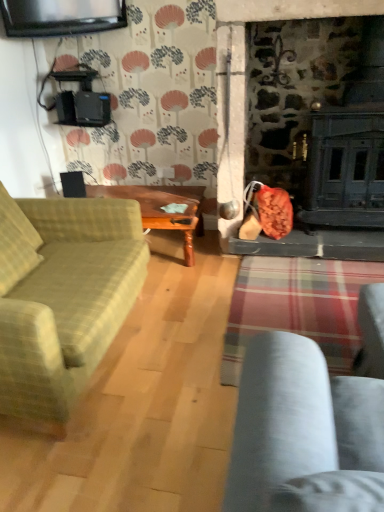
This screenshot has width=384, height=512. Find the location of `wooden polished table at center`. wooden polished table at center is located at coordinates (161, 208).

This screenshot has height=512, width=384. What do you see at coordinates (161, 208) in the screenshot?
I see `wooden polished table at center` at bounding box center [161, 208].

Looking at this image, what is the approximate width of wooden polished table at center?

wooden polished table at center is 24.17 inches in width.

You are a GUI agent. You are given a task and a screenshot of the screen. Output one action in this format:
    pyautogui.click(x=<x>, y=<y>)
    Task: Click on the green plaid fabric couch at left
    This screenshot has height=512, width=384.
    Given the screenshot: What is the action you would take?
    pyautogui.click(x=62, y=295)

Image resolution: width=384 pixels, height=512 pixels. What do you see at coordinates (62, 295) in the screenshot?
I see `green plaid fabric couch at left` at bounding box center [62, 295].

Image resolution: width=384 pixels, height=512 pixels. Identify the location of wooden polished table at center. (161, 208).

Is wooden polished table at center at the right side of green plaid fabric couch at left?

Correct, you'll find wooden polished table at center to the right of green plaid fabric couch at left.

Is the position of wooden polished table at center more distant than that of green plaid fabric couch at left?

Yes, wooden polished table at center is behind green plaid fabric couch at left.

Considering the positions of point (141, 191) and point (5, 318), is point (141, 191) closer or farther from the camera than point (5, 318)?

Point (141, 191).

From the image's perspective, which one is positioned lower, wooden polished table at center or green plaid fabric couch at left?

green plaid fabric couch at left, from the image's perspective.

From a real-world perspective, is wooden polished table at center positioned above or below green plaid fabric couch at left?

In terms of real-world spatial position, wooden polished table at center is below green plaid fabric couch at left.

Considering the sizes of objects wooden polished table at center and green plaid fabric couch at left in the image provided, who is wider, wooden polished table at center or green plaid fabric couch at left?

green plaid fabric couch at left is wider.

Considering the relative sizes of wooden polished table at center and green plaid fabric couch at left in the image provided, is wooden polished table at center shorter than green plaid fabric couch at left?

Yes, wooden polished table at center is shorter than green plaid fabric couch at left.

Looking at this image, considering the relative sizes of wooden polished table at center and green plaid fabric couch at left in the image provided, is wooden polished table at center smaller than green plaid fabric couch at left?

Yes, wooden polished table at center is smaller than green plaid fabric couch at left.

Which is correct: wooden polished table at center is inside green plaid fabric couch at left, or outside of it?

wooden polished table at center is located beyond the bounds of green plaid fabric couch at left.

Is wooden polished table at center next to green plaid fabric couch at left?

No, wooden polished table at center is not touching green plaid fabric couch at left.

Based on the photo, is wooden polished table at center oriented towards green plaid fabric couch at left?

Yes, wooden polished table at center faces towards green plaid fabric couch at left.

How distant is wooden polished table at center from green plaid fabric couch at left?

The distance of wooden polished table at center from green plaid fabric couch at left is 33.48 inches.

Identify the location of table behind the green plaid fabric couch at left. The width and height of the screenshot is (384, 512). (161, 208).

Consider the image. Based on their positions, is green plaid fabric couch at left located to the left or right of wooden polished table at center?

green plaid fabric couch at left is to the left of wooden polished table at center.

Who is more distant, green plaid fabric couch at left or wooden polished table at center?

Positioned behind is wooden polished table at center.

Between point (66, 342) and point (192, 231), which one is positioned behind?

The point (192, 231) is farther.

From the image's perspective, between green plaid fabric couch at left and wooden polished table at center, which one is located above?

wooden polished table at center.

From a real-world perspective, is green plaid fabric couch at left physically located above or below wooden polished table at center?

In terms of real-world spatial position, green plaid fabric couch at left is above wooden polished table at center.

Is green plaid fabric couch at left wider or thinner than wooden polished table at center?

Clearly, green plaid fabric couch at left has more width compared to wooden polished table at center.

Considering the relative sizes of green plaid fabric couch at left and wooden polished table at center in the image provided, is green plaid fabric couch at left taller than wooden polished table at center?

Yes.

Considering the sizes of objects green plaid fabric couch at left and wooden polished table at center in the image provided, who is bigger, green plaid fabric couch at left or wooden polished table at center?

Bigger between the two is green plaid fabric couch at left.

Can wooden polished table at center be found inside green plaid fabric couch at left?

That's incorrect, wooden polished table at center is not inside green plaid fabric couch at left.

Is the surface of green plaid fabric couch at left in direct contact with wooden polished table at center?

There is a gap between green plaid fabric couch at left and wooden polished table at center.

Is green plaid fabric couch at left looking in the opposite direction of wooden polished table at center?

No, green plaid fabric couch at left's orientation is not away from wooden polished table at center.

How different are the orientations of green plaid fabric couch at left and wooden polished table at center in degrees?

The angle between the facing direction of green plaid fabric couch at left and the facing direction of wooden polished table at center is 89.3 degrees.

Measure the distance from green plaid fabric couch at left to wooden polished table at center.

green plaid fabric couch at left is 33.48 inches from wooden polished table at center.

In the image, there is a wooden polished table at center. Where is `studio couch below it (from the image's perspective)`? studio couch below it (from the image's perspective) is located at coordinates [62, 295].

Identify the location of table lying above the green plaid fabric couch at left (from the image's perspective). This screenshot has width=384, height=512. (161, 208).

Locate an element on the screen. The height and width of the screenshot is (512, 384). table on the right of green plaid fabric couch at left is located at coordinates (161, 208).